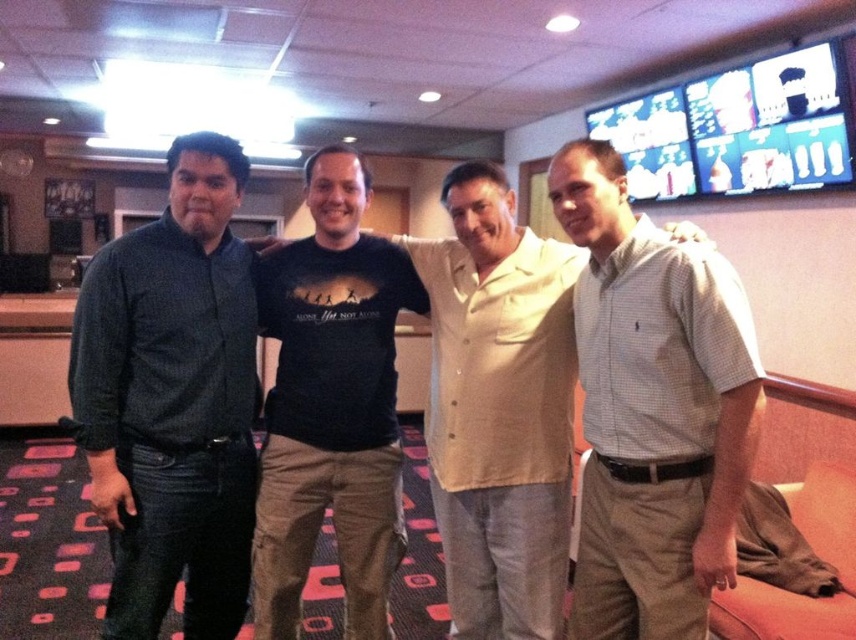
You are standing in the room and want to hand a gift to the person wearing the white checkered shirt at center and the light beige shirt at center. Which one can you reach first without moving closer?

The white checkered shirt at center is closer to the viewer than the light beige shirt at center, so you can reach the person wearing the white checkered shirt at center first without moving closer.

You are a photographer setting up a photo shoot in the room described. You need to position two subjects wearing the dark blue shirt at left and the white checkered shirt at center so that they appear equally wide in the final photo. Given their current widths, what adjustment should you make to their positions?

Since the dark blue shirt at left is wider than the white checkered shirt at center, you should move the dark blue shirt at left farther away from the camera and bring the white checkered shirt at center closer. This way, their apparent widths in the photo will balance out.